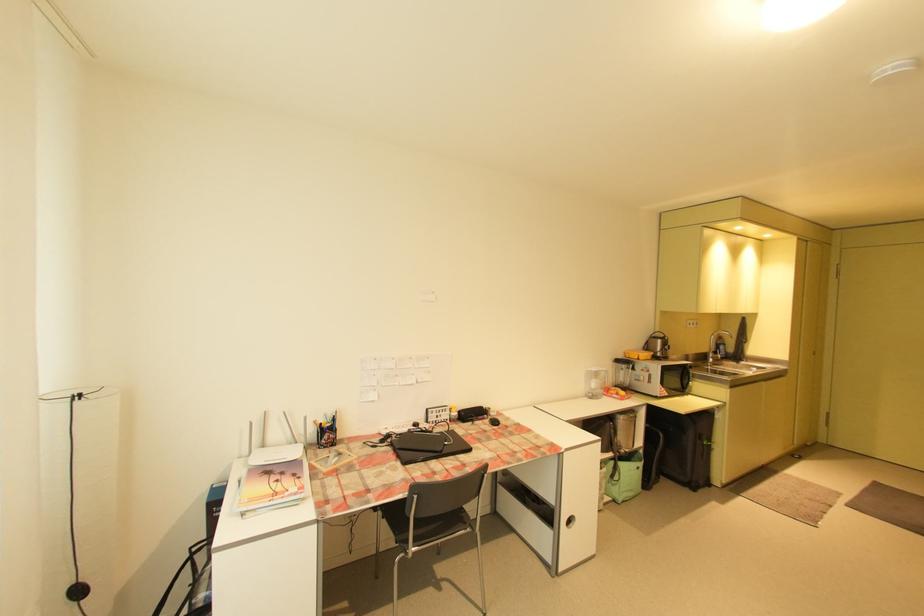
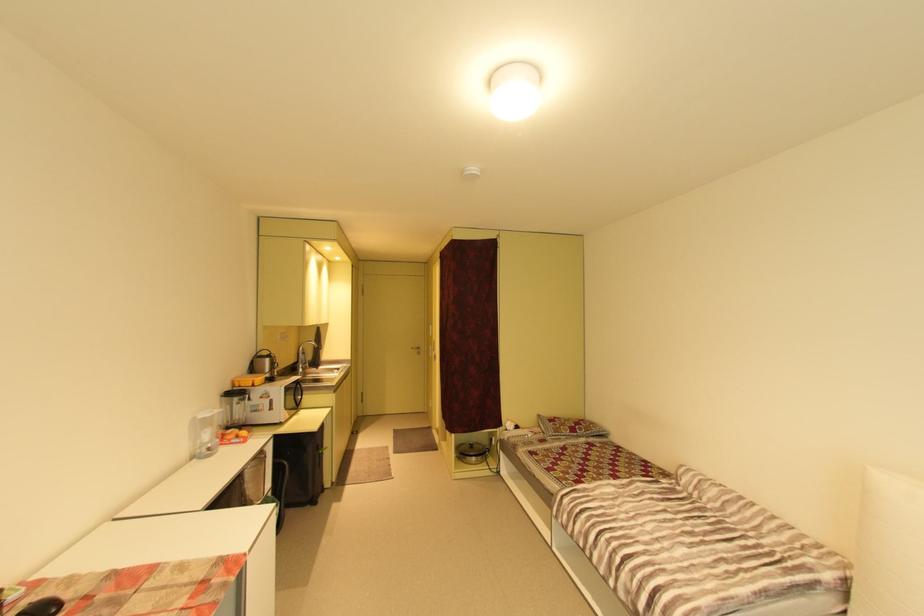
Find the pixel in the second image that matches the point at 635,354 in the first image.

(246, 381)